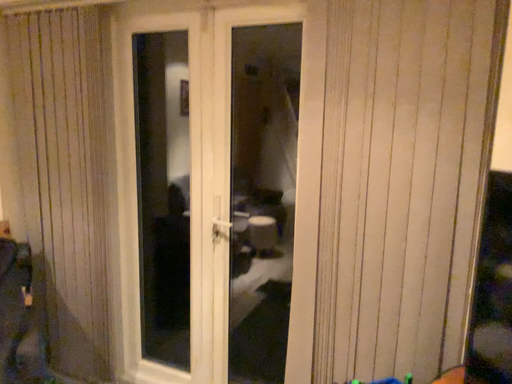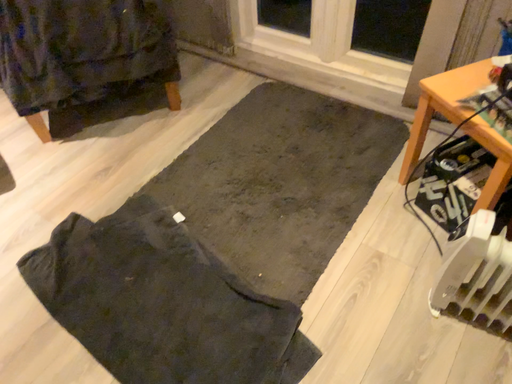
Question: How did the camera likely rotate when shooting the video?

Choices:
 (A) rotated right
 (B) rotated left

Answer: (B)